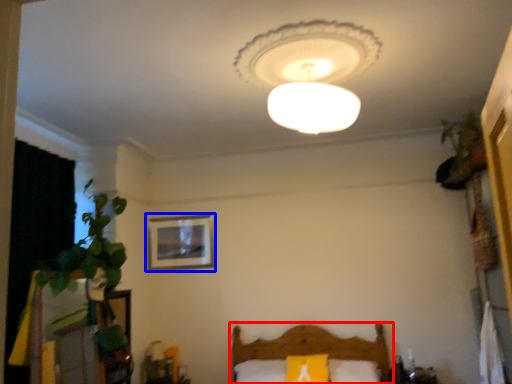
Question: Which object is further to the camera taking this photo, furniture (highlighted by a red box) or picture frame (highlighted by a blue box)?

Choices:
 (A) furniture
 (B) picture frame

Answer: (B)